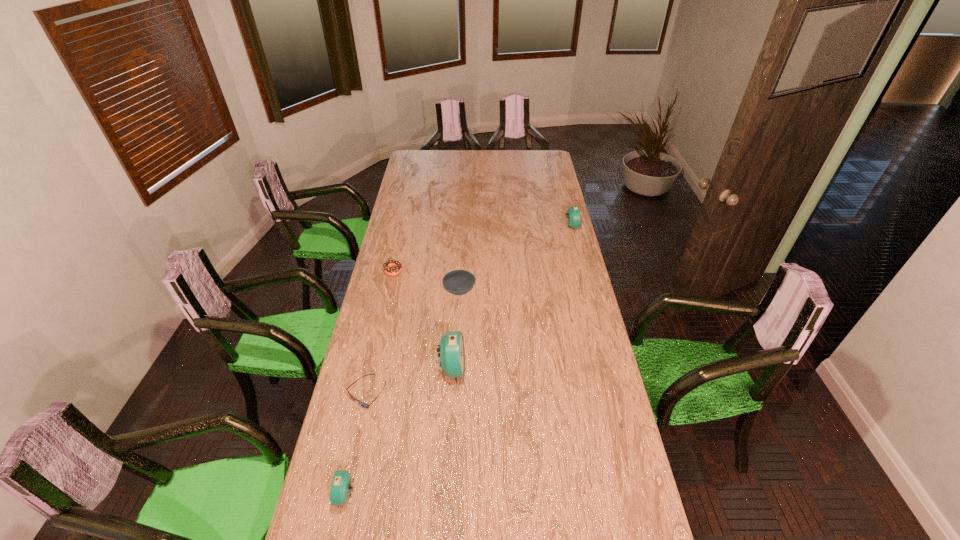
I want to click on the shortest alarm clock, so click(341, 484).

You are a GUI agent. You are given a task and a screenshot of the screen. Output one action in this format:
    pyautogui.click(x=<x>, y=<y>)
    Task: Click on the leftmost alarm clock
    
    Given the screenshot: What is the action you would take?
    [341, 484]

This screenshot has height=540, width=960. I want to click on the tallest alarm clock, so click(452, 352).

In order to click on the second farthest alarm clock in this screenshot , I will do `click(452, 352)`.

The width and height of the screenshot is (960, 540). Identify the location of the second tallest alarm clock. (573, 213).

Find the location of a particular element. The image size is (960, 540). the farthest object is located at coordinates tap(573, 213).

Find the location of a particular element. The width and height of the screenshot is (960, 540). sunglasses is located at coordinates (365, 405).

Find the location of a particular element. This screenshot has height=540, width=960. the third shortest object is located at coordinates (458, 282).

Locate an element on the screen. The width and height of the screenshot is (960, 540). the third farthest object is located at coordinates (458, 282).

This screenshot has width=960, height=540. Identify the location of the second farthest object. (387, 265).